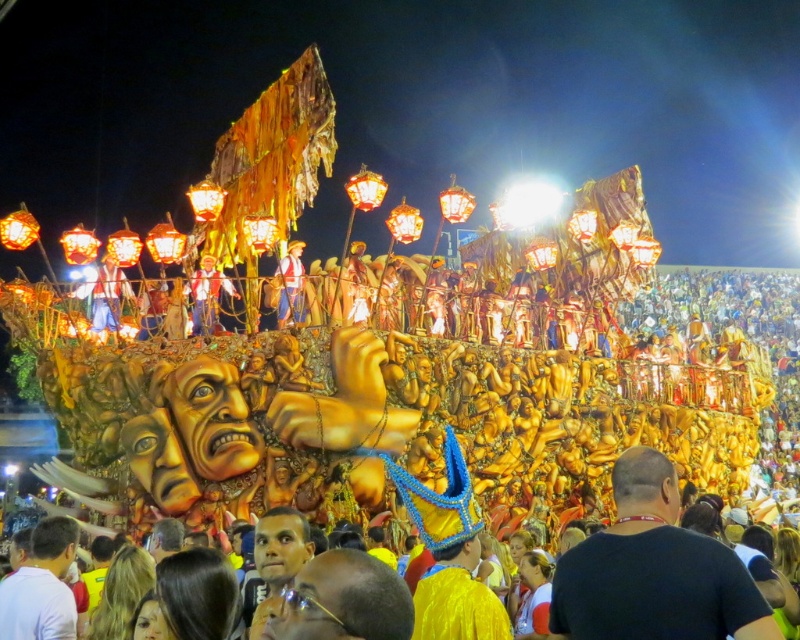
Question: Is matte gold figure at upper center closer to the viewer compared to matte gold statue at center?

Choices:
 (A) yes
 (B) no

Answer: (A)

Question: Does matte gold figure at upper center lie behind matte blue jeans at center?

Choices:
 (A) no
 (B) yes

Answer: (B)

Question: Based on their relative distances, which object is farther from the matte gold statue at center?

Choices:
 (A) matte blue jeans at center
 (B) black matte shirt at center

Answer: (B)

Question: Among these points, which one is farthest from the camera?

Choices:
 (A) (605, 592)
 (B) (298, 272)
 (C) (212, 272)
 (D) (104, 323)

Answer: (C)

Question: Among these points, which one is nearest to the camera?

Choices:
 (A) (636, 637)
 (B) (218, 289)
 (C) (96, 300)
 (D) (277, 304)

Answer: (A)

Question: Where is black matte shirt at center located in relation to matte gold statue at center in the image?

Choices:
 (A) right
 (B) left

Answer: (A)